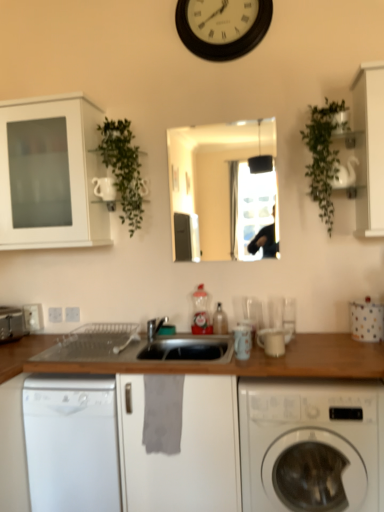
Locate an element on the screen. free area below green leafy plant at upper right, which is counted as the 1th plant, starting from the right (from a real-world perspective) is located at coordinates (331, 336).